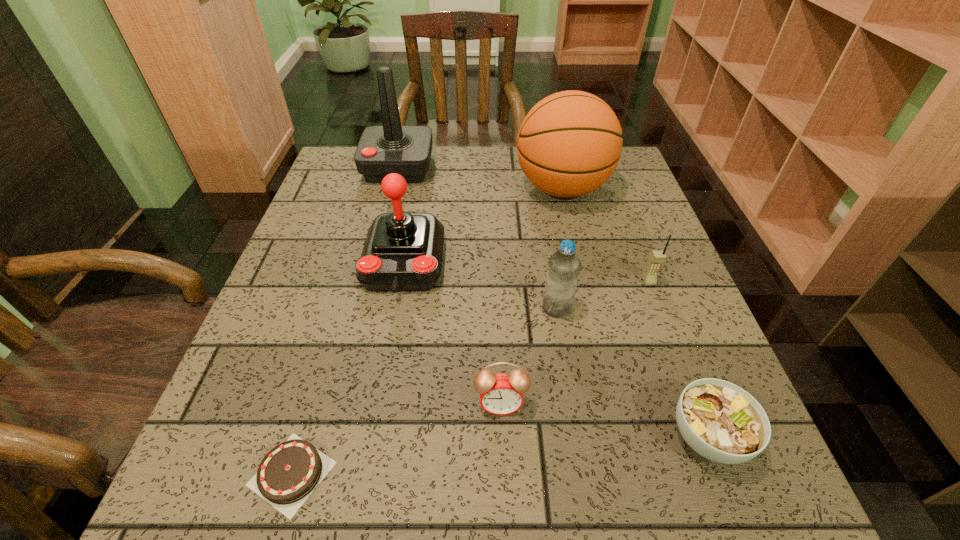
The height and width of the screenshot is (540, 960). I want to click on free space between the alarm clock and the chocolate cake, so click(396, 439).

You are a GUI agent. You are given a task and a screenshot of the screen. Output one action in this format:
    pyautogui.click(x=<x>, y=<y>)
    Task: Click on the free space between the fourth tallest object and the cellular telephone
    This screenshot has width=960, height=540.
    Given the screenshot: What is the action you would take?
    pyautogui.click(x=603, y=294)

Locate an element on the screen. vacant area that lies between the basketball and the sixth tallest object is located at coordinates (531, 296).

Identify the location of vacant point located between the taller joystick and the sixth tallest object. (449, 286).

Image resolution: width=960 pixels, height=540 pixels. What are the coordinates of `free space between the basketball and the chocolate cake` in the screenshot? It's located at (427, 331).

You are a GUI agent. You are given a task and a screenshot of the screen. Output one action in this format:
    pyautogui.click(x=<x>, y=<y>)
    Task: Click on the free spot between the third tallest object and the soup bowl
    Image resolution: width=960 pixels, height=540 pixels.
    Given the screenshot: What is the action you would take?
    pyautogui.click(x=556, y=349)

Locate an element on the screen. This screenshot has width=960, height=540. unoccupied area between the alarm clock and the nearer joystick is located at coordinates (452, 334).

Locate which object ranks in proximity to the third tallest object. Please provide its 2D coordinates. Your answer should be formatted as a tuple, i.e. [(x, y)], where the tuple contains the x and y coordinates of a point satisfying the conditions above.

[(406, 150)]

Locate which object is the fifth closest to the shortest object. Please provide its 2D coordinates. Your answer should be formatted as a tuple, i.e. [(x, y)], where the tuple contains the x and y coordinates of a point satisfying the conditions above.

[(569, 144)]

The width and height of the screenshot is (960, 540). Identify the location of blank area in the image that satisfies the following two spatial constraints: 1. on the back side of the basketball; 2. on the left side of the chocolate cake. (375, 189).